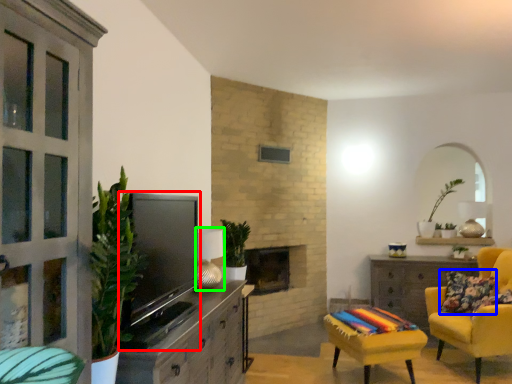
Question: Which is farther away from television (highlighted by a red box)? pillow (highlighted by a blue box) or lamp (highlighted by a green box)?

Choices:
 (A) pillow
 (B) lamp

Answer: (A)